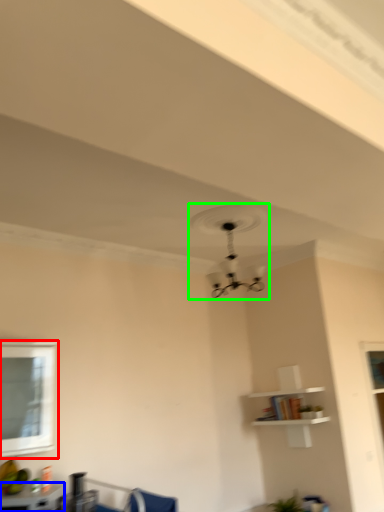
Question: Which object is positioned farthest from window (highlighted by a red box)? Select from table (highlighted by a blue box) and fan (highlighted by a green box).

Choices:
 (A) table
 (B) fan

Answer: (B)